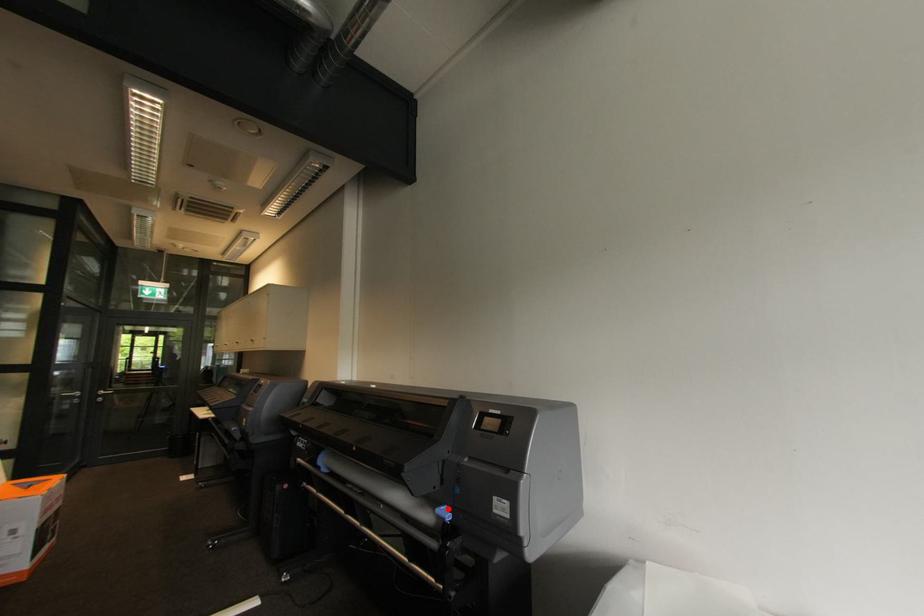
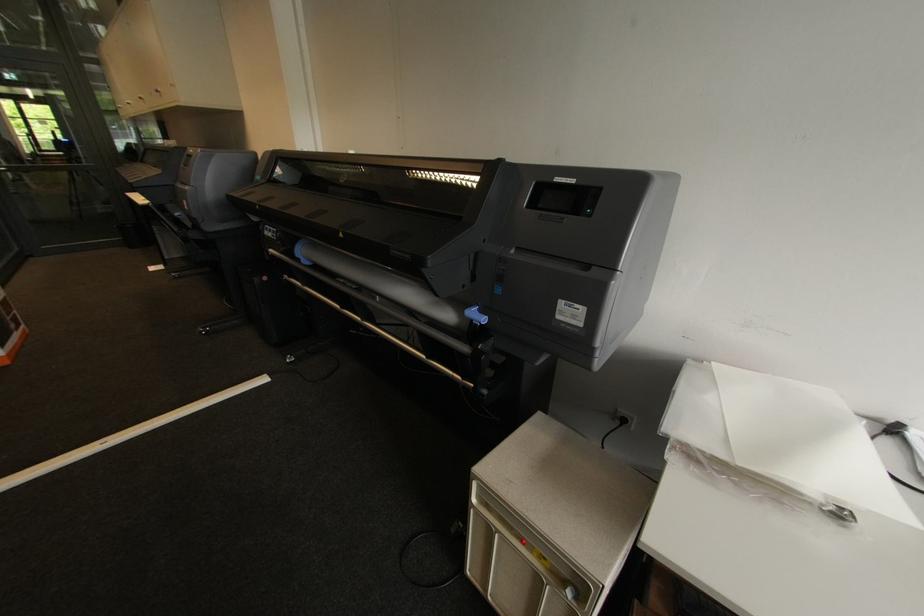
Question: I am providing you with two images of the same scene from different viewpoints. In image1, a red point is highlighted. Considering the same 3D point in image2, which of the following is correct?

Choices:
 (A) It is closer
 (B) It is farther

Answer: (A)